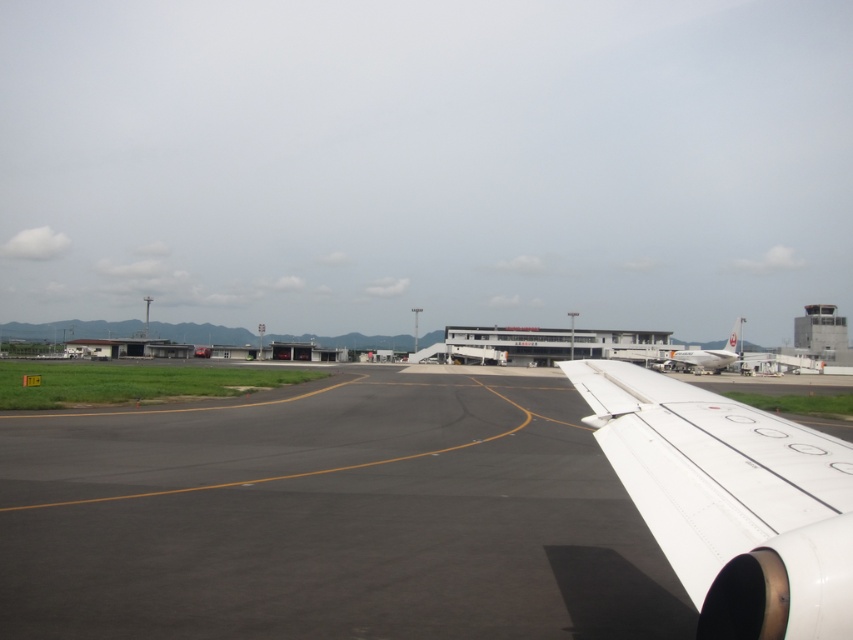
Can you confirm if black asphalt tarmac at center is wider than white glossy airplane at right?

No, black asphalt tarmac at center is not wider than white glossy airplane at right.

Who is higher up, black asphalt tarmac at center or white glossy airplane at right?

black asphalt tarmac at center is above.

Between point (689, 416) and point (712, 358), which one is positioned in front?

Positioned in front is point (689, 416).

Image resolution: width=853 pixels, height=640 pixels. What are the coordinates of `black asphalt tarmac at center` in the screenshot? It's located at (410, 515).

Consider the image. Who is positioned more to the right, white matte wing at right or white glossy airplane at right?

Positioned to the right is white glossy airplane at right.

Which is behind, point (825, 608) or point (728, 337)?

Point (728, 337)

Who is more forward, [659,435] or [734,328]?

Positioned in front is point [659,435].

Image resolution: width=853 pixels, height=640 pixels. I want to click on white matte wing at right, so click(x=730, y=500).

Is black asphalt tarmac at center further to the viewer compared to white matte wing at right?

Yes, black asphalt tarmac at center is behind white matte wing at right.

Is black asphalt tarmac at center smaller than white matte wing at right?

No, black asphalt tarmac at center is not smaller than white matte wing at right.

The width and height of the screenshot is (853, 640). What do you see at coordinates (410, 515) in the screenshot? I see `black asphalt tarmac at center` at bounding box center [410, 515].

This screenshot has height=640, width=853. In order to click on black asphalt tarmac at center in this screenshot , I will do `click(410, 515)`.